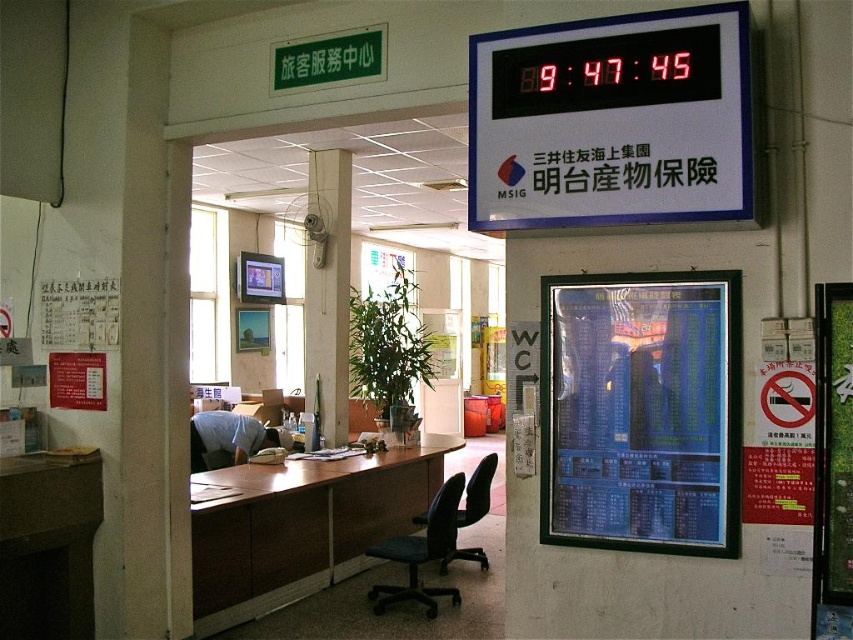
In the scene shown: You are a customer entering the service center and need to check the time. The red digital clock at upper right is mounted on the wall. Can you see the brown wood table at center from where you are standing?

The red digital clock at upper right has a lesser height compared to brown wood table at center, so yes, you can see the brown wood table at center because it is taller and likely more visible.

You are standing at the entrance of the service center and see the blue glossy poster at upper center and the digital clock on the wall. Which object is closer to you?

The blue glossy poster at upper center is closer to you because they are 8.59 feet apart.

You are a customer entering the service center and looking at the reception desk. Which object, the red digital clock at upper right or the blue glossy poster at upper center, is positioned higher on the wall?

The red digital clock at upper right is positioned higher on the wall than the blue glossy poster at upper center.